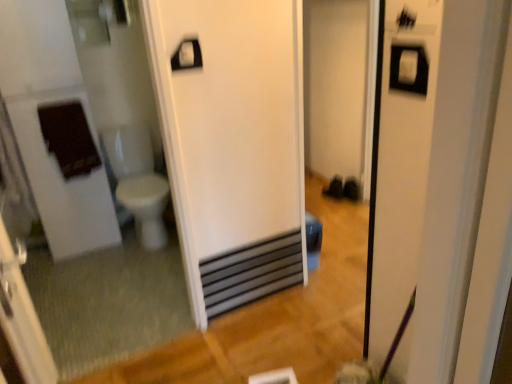
Question: Does black metallic water heater at center have a larger size compared to white plastic towel bar at upper center?

Choices:
 (A) yes
 (B) no

Answer: (A)

Question: Is black metallic water heater at center surrounding white plastic towel bar at upper center?

Choices:
 (A) no
 (B) yes

Answer: (A)

Question: Does black metallic water heater at center have a smaller size compared to white plastic towel bar at upper center?

Choices:
 (A) no
 (B) yes

Answer: (A)

Question: Is black metallic water heater at center beside white plastic towel bar at upper center?

Choices:
 (A) yes
 (B) no

Answer: (B)

Question: Considering the relative positions of black metallic water heater at center and white plastic towel bar at upper center in the image provided, is black metallic water heater at center to the right of white plastic towel bar at upper center from the viewer's perspective?

Choices:
 (A) no
 (B) yes

Answer: (B)

Question: Considering the positions of white glossy mirror at left and white glossy toilet bowl at left in the image, is white glossy mirror at left wider or thinner than white glossy toilet bowl at left?

Choices:
 (A) thin
 (B) wide

Answer: (A)

Question: From the image's perspective, relative to white glossy toilet bowl at left, is white glossy mirror at left above or below?

Choices:
 (A) above
 (B) below

Answer: (B)

Question: Is white glossy mirror at left taller or shorter than white glossy toilet bowl at left?

Choices:
 (A) tall
 (B) short

Answer: (A)

Question: From a real-world perspective, is white glossy mirror at left above or below white glossy toilet bowl at left?

Choices:
 (A) above
 (B) below

Answer: (A)

Question: In terms of width, does transparent plastic screen door at left look wider or thinner when compared to white plastic towel bar at upper center?

Choices:
 (A) thin
 (B) wide

Answer: (B)

Question: Considering the positions of transparent plastic screen door at left and white plastic towel bar at upper center in the image, is transparent plastic screen door at left bigger or smaller than white plastic towel bar at upper center?

Choices:
 (A) big
 (B) small

Answer: (A)

Question: Does point (32, 331) appear closer or farther from the camera than point (181, 56)?

Choices:
 (A) closer
 (B) farther

Answer: (A)

Question: Do you think transparent plastic screen door at left is within white plastic towel bar at upper center, or outside of it?

Choices:
 (A) inside
 (B) outside

Answer: (B)

Question: Visually, is transparent plastic screen door at left positioned to the left or to the right of black metallic water heater at center?

Choices:
 (A) left
 (B) right

Answer: (A)

Question: Looking at the image, does transparent plastic screen door at left seem bigger or smaller compared to black metallic water heater at center?

Choices:
 (A) small
 (B) big

Answer: (B)